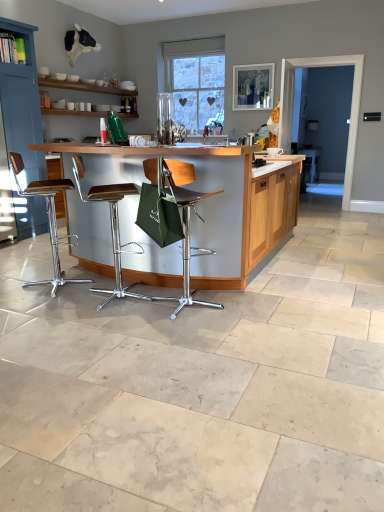
Question: Is wooden table at center wider or thinner than transparent glass door at right?

Choices:
 (A) thin
 (B) wide

Answer: (B)

Question: Considering their positions, is wooden table at center located in front of or behind transparent glass door at right?

Choices:
 (A) behind
 (B) front

Answer: (B)

Question: Based on their relative distances, which object is nearer to the transparent glass door at right?

Choices:
 (A) blue painted wood cabinet at left
 (B) green fabric chair at center, the first chair positioned from the right
 (C) metallic brown stool at center, acting as the 2th chair starting from the left
 (D) wooden table at center
 (E) metallic brown stool at left, marked as the third chair in a right-to-left arrangement

Answer: (D)

Question: Which of these objects is positioned farthest from the green fabric chair at center, the first chair positioned from the right?

Choices:
 (A) transparent glass door at right
 (B) metallic brown stool at center, acting as the 2th chair starting from the left
 (C) wooden table at center
 (D) metallic brown stool at left, marked as the third chair in a right-to-left arrangement
 (E) blue painted wood cabinet at left

Answer: (A)